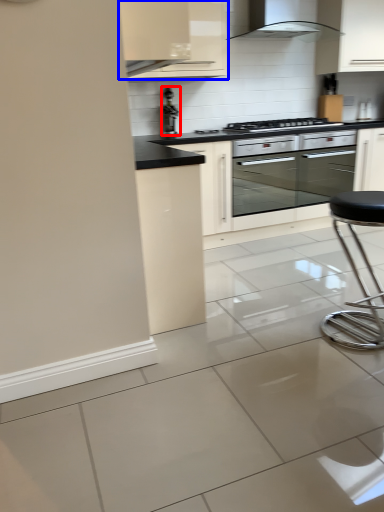
Question: Which of the following is the farthest to the observer, appliance (highlighted by a red box) or cabinetry (highlighted by a blue box)?

Choices:
 (A) appliance
 (B) cabinetry

Answer: (A)